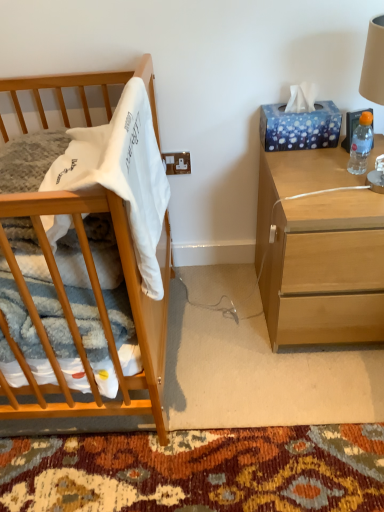
Question: Is blue glossy tissue box at upper right smaller than clear plastic bottle at right?

Choices:
 (A) no
 (B) yes

Answer: (A)

Question: From the image's perspective, does blue glossy tissue box at upper right appear higher than clear plastic bottle at right?

Choices:
 (A) no
 (B) yes

Answer: (B)

Question: Does blue glossy tissue box at upper right lie behind clear plastic bottle at right?

Choices:
 (A) yes
 (B) no

Answer: (A)

Question: Is blue glossy tissue box at upper right outside clear plastic bottle at right?

Choices:
 (A) yes
 (B) no

Answer: (A)

Question: From the image's perspective, is blue glossy tissue box at upper right located beneath clear plastic bottle at right?

Choices:
 (A) no
 (B) yes

Answer: (A)

Question: Are blue glossy tissue box at upper right and clear plastic bottle at right beside each other?

Choices:
 (A) yes
 (B) no

Answer: (B)

Question: Can you confirm if light brown wood crib at left is thinner than white soft fabric at left?

Choices:
 (A) no
 (B) yes

Answer: (A)

Question: Is light brown wood crib at left oriented away from white soft fabric at left?

Choices:
 (A) no
 (B) yes

Answer: (A)

Question: From a real-world perspective, is light brown wood crib at left below white soft fabric at left?

Choices:
 (A) yes
 (B) no

Answer: (A)

Question: Is light brown wood crib at left outside of white soft fabric at left?

Choices:
 (A) no
 (B) yes

Answer: (B)

Question: From the image's perspective, is light brown wood crib at left located above white soft fabric at left?

Choices:
 (A) yes
 (B) no

Answer: (B)

Question: Is light brown wood crib at left positioned in front of white soft fabric at left?

Choices:
 (A) yes
 (B) no

Answer: (A)

Question: Does clear plastic bottle at right have a greater height compared to light wood nightstand at right?

Choices:
 (A) yes
 (B) no

Answer: (B)